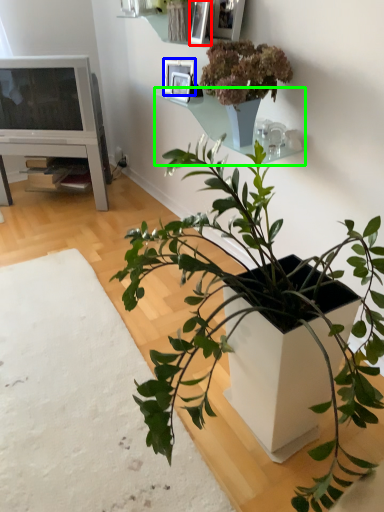
Question: Based on their relative distances, which object is farther from picture frame (highlighted by a red box)? Choose from picture frame (highlighted by a blue box) and shelf (highlighted by a green box).

Choices:
 (A) picture frame
 (B) shelf

Answer: (B)